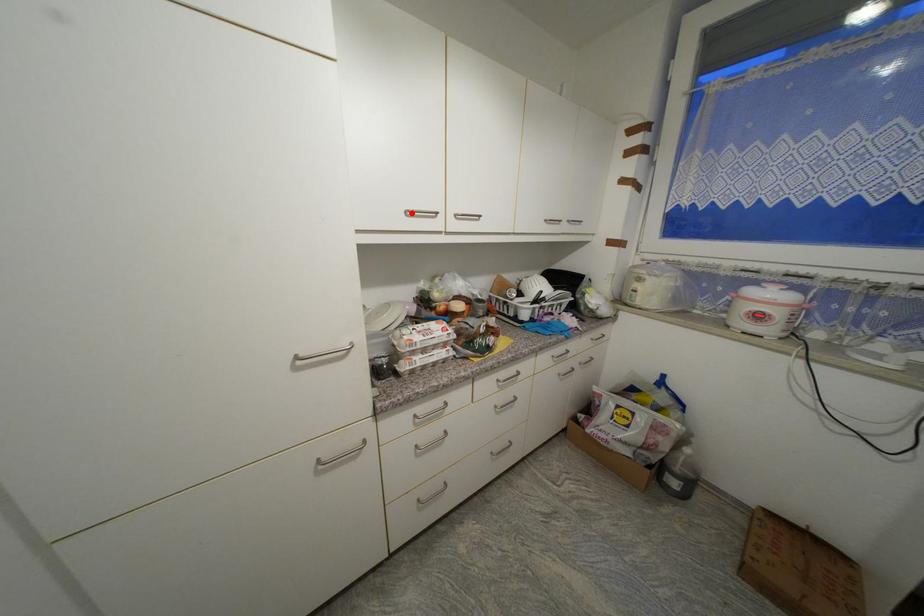
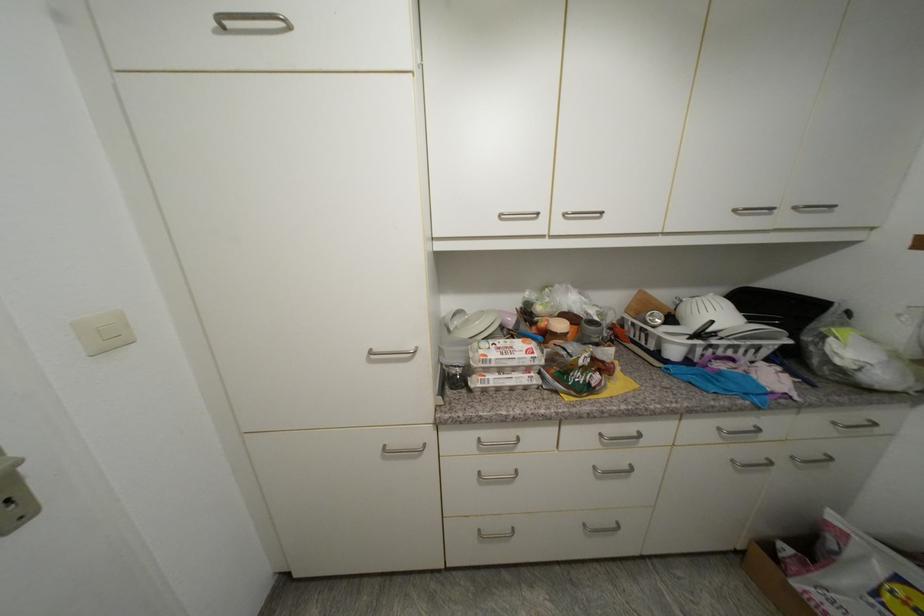
Locate, in the second image, the point that corresponds to the highlighted location in the first image.

(505, 217)